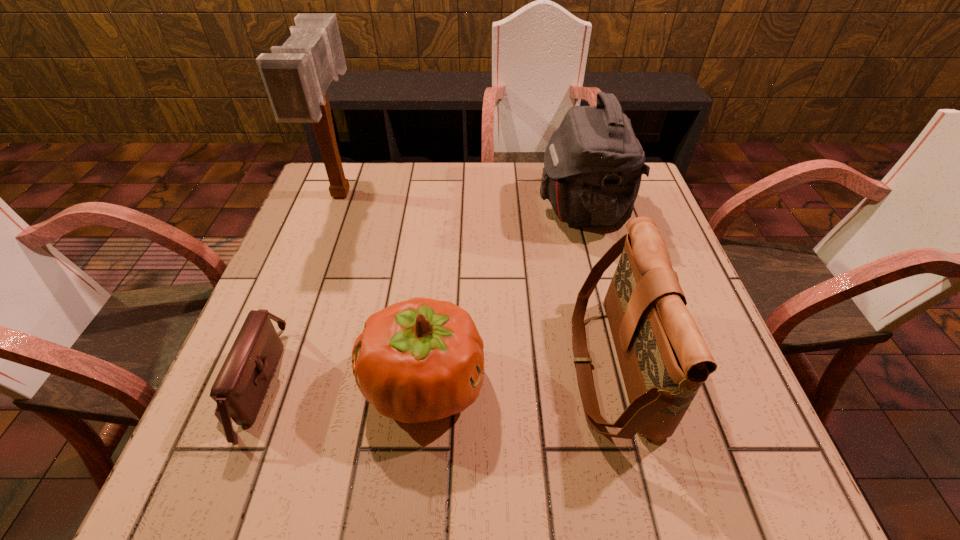
Where is `vacant space located 0.060m on the open flap of the tallest shoulder bag`? The width and height of the screenshot is (960, 540). vacant space located 0.060m on the open flap of the tallest shoulder bag is located at coordinates (516, 208).

The width and height of the screenshot is (960, 540). What are the coordinates of `free point located 0.400m on the open flap of the tallest shoulder bag` in the screenshot? It's located at (387, 208).

Identify the location of free space located on the front-facing side of the third tallest object. The width and height of the screenshot is (960, 540). (377, 366).

Find the location of a particular element. This screenshot has height=540, width=960. free space located 0.340m on the front-facing side of the third tallest object is located at coordinates (393, 366).

Locate an element on the screen. vacant area situated 0.200m on the front-facing side of the third tallest object is located at coordinates pos(467,366).

What are the coordinates of `free space located on the side of the pumpkin with the cute face` in the screenshot? It's located at (692, 384).

I want to click on free space located 0.060m on the front flap of the shortest object, so click(309, 384).

This screenshot has height=540, width=960. I want to click on mallet at the far edge, so click(x=296, y=75).

Find the location of `shoulder bag situated at the far edge`. shoulder bag situated at the far edge is located at coordinates (593, 164).

In order to click on pumpkin that is at the near edge in this screenshot , I will do `click(420, 360)`.